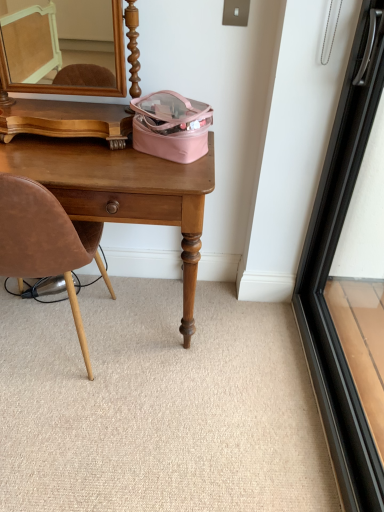
Question: From the image's perspective, is beige carpet at lower center located above or below wooden desk at center?

Choices:
 (A) below
 (B) above

Answer: (A)

Question: Would you say beige carpet at lower center is to the left or to the right of wooden desk at center in the picture?

Choices:
 (A) right
 (B) left

Answer: (A)

Question: Which object is the closest to the beige carpet at lower center?

Choices:
 (A) brown leather chair at left
 (B) wooden desk at center
 (C) black glass screen door at right

Answer: (A)

Question: Based on their relative distances, which object is farther from the brown leather chair at left?

Choices:
 (A) beige carpet at lower center
 (B) black glass screen door at right
 (C) wooden desk at center

Answer: (B)